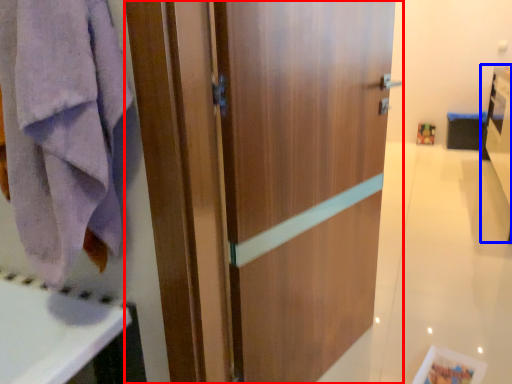
Question: Among these objects, which one is farthest to the camera, door (highlighted by a red box) or vanity (highlighted by a blue box)?

Choices:
 (A) door
 (B) vanity

Answer: (B)